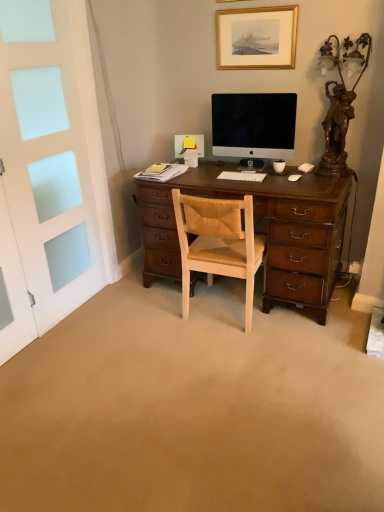
Question: From a real-world perspective, is gold-framed picture at upper center physically below white frosted glass screen door at left?

Choices:
 (A) yes
 (B) no

Answer: (B)

Question: Is gold-framed picture at upper center with white frosted glass screen door at left?

Choices:
 (A) yes
 (B) no

Answer: (B)

Question: Is there a large distance between gold-framed picture at upper center and white frosted glass screen door at left?

Choices:
 (A) no
 (B) yes

Answer: (B)

Question: Is gold-framed picture at upper center behind white frosted glass screen door at left?

Choices:
 (A) yes
 (B) no

Answer: (A)

Question: From the image's perspective, is gold-framed picture at upper center below white frosted glass screen door at left?

Choices:
 (A) no
 (B) yes

Answer: (A)

Question: From the image's perspective, is white matte computer mouse at right, which is the first computer mouse in right-to-left order, above or below gold-framed picture at upper center?

Choices:
 (A) below
 (B) above

Answer: (A)

Question: In the image, is white matte computer mouse at right, arranged as the second computer mouse when viewed from the front, positioned in front of or behind gold-framed picture at upper center?

Choices:
 (A) front
 (B) behind

Answer: (B)

Question: Considering the positions of white matte computer mouse at right, the 2th computer mouse when ordered from left to right, and gold-framed picture at upper center in the image, is white matte computer mouse at right, the 2th computer mouse when ordered from left to right, wider or thinner than gold-framed picture at upper center?

Choices:
 (A) thin
 (B) wide

Answer: (B)

Question: In terms of size, does white matte computer mouse at right, which is the second computer mouse from bottom to top, appear bigger or smaller than gold-framed picture at upper center?

Choices:
 (A) big
 (B) small

Answer: (B)

Question: Choose the correct answer: Is white matte computer mouse at center-right, the 1th computer mouse positioned from the left, inside white frosted glass screen door at left or outside it?

Choices:
 (A) outside
 (B) inside

Answer: (A)

Question: Is white matte computer mouse at center-right, the second computer mouse when ordered from top to bottom, taller or shorter than white frosted glass screen door at left?

Choices:
 (A) tall
 (B) short

Answer: (B)

Question: From a real-world perspective, is white matte computer mouse at center-right, which is counted as the second computer mouse, starting from the right, positioned above or below white frosted glass screen door at left?

Choices:
 (A) above
 (B) below

Answer: (B)

Question: Considering the positions of point (299, 176) and point (54, 121), is point (299, 176) closer or farther from the camera than point (54, 121)?

Choices:
 (A) closer
 (B) farther

Answer: (B)

Question: Is white matte computer mouse at right, which is the second computer mouse from bottom to top, bigger or smaller than white matte computer mouse at center-right, which is counted as the second computer mouse, starting from the right?

Choices:
 (A) big
 (B) small

Answer: (A)

Question: From a real-world perspective, is white matte computer mouse at right, which is the second computer mouse from bottom to top, positioned above or below white matte computer mouse at center-right, the 1th computer mouse in the bottom-to-top sequence?

Choices:
 (A) above
 (B) below

Answer: (A)